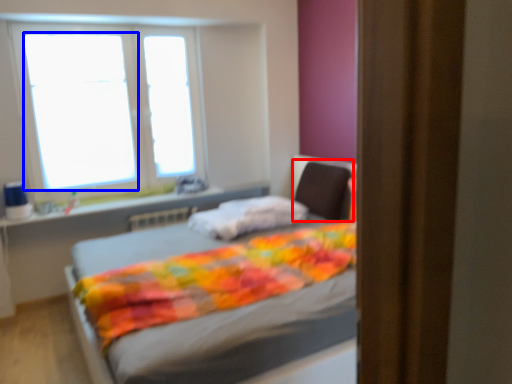
Question: Which point is further to the camera, swivel chair (highlighted by a red box) or window screen (highlighted by a blue box)?

Choices:
 (A) swivel chair
 (B) window screen

Answer: (B)